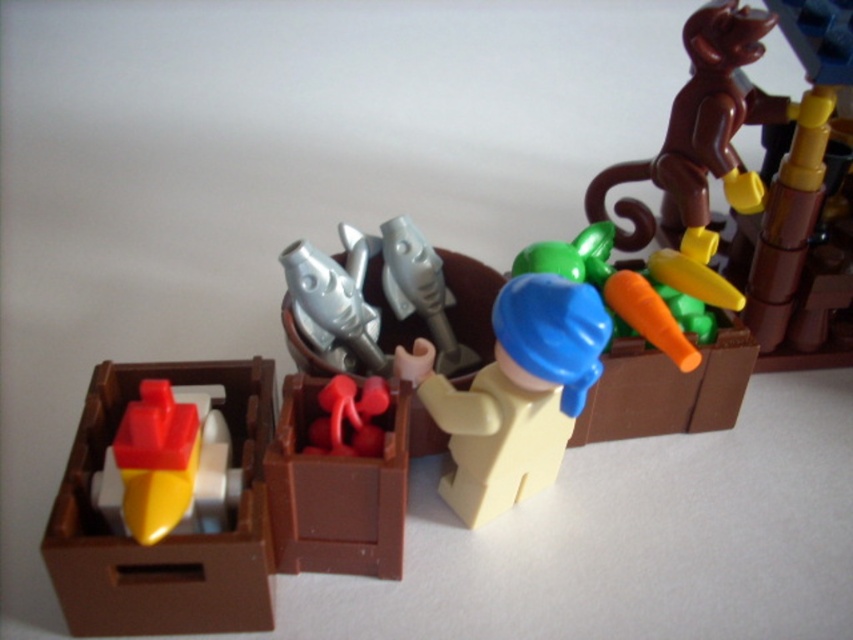
You are organizing a Lego set and need to place the brown matte box at center and the rubberized red toy at center into a storage container. If the container can only hold items that are on the left side of each other, will both items fit?

The brown matte box at center is positioned on the left side of the rubberized red toy at center, so both items can fit into the storage container since their arrangement meets the requirement of items being on the left side of each other.

You are a Lego enthusiast trying to build a tower using the objects in the image. The brown matte box at center and the rubberized red toy at center are both available. Which object should you choose if you want to make the tower taller?

The brown matte box at center has a greater height compared to the rubberized red toy at center, so choosing the brown matte box at center would allow you to make the tower taller.

You are organizing a Lego set and need to place the matte brown box at left and the yellow matte figure at center into a storage container. Which object should you place first to ensure both fit properly?

The matte brown box at left is thinner than the yellow matte figure at center, so you should place the yellow matte figure at center first to make space for the thinner matte brown box at left.